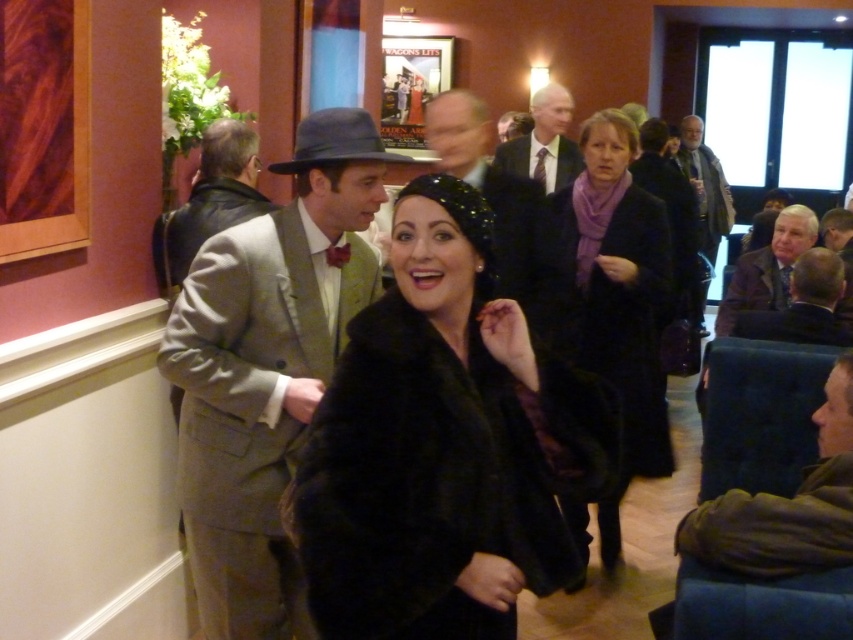
What is the color of the object located at coordinates point [767,268]?

The object at point [767,268] is a brown leather jacket.

You are a photographer at the event and need to ensure that both the light beige wool suit at center and the matte black fedora at center fit within the frame. Given that the camera has a fixed focal length, which object should you adjust your focus on to accommodate the larger size?

The light beige wool suit at center has a larger width than the matte black fedora at center, so you should adjust your focus to accommodate the light beige wool suit at center first to ensure it fits within the frame.